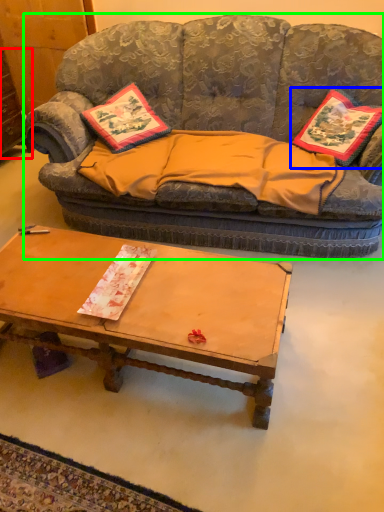
Question: Estimate the real-world distances between objects in this image. Which object is farther from dresser (highlighted by a red box), pillow (highlighted by a blue box) or studio couch (highlighted by a green box)?

Choices:
 (A) pillow
 (B) studio couch

Answer: (A)